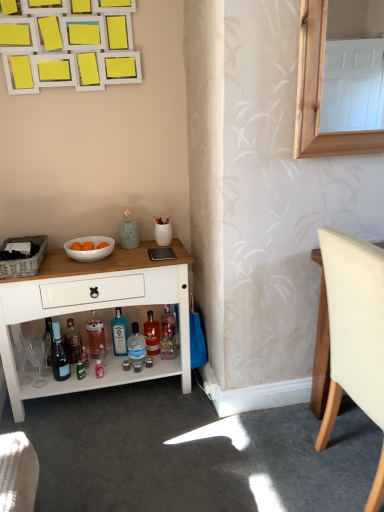
Question: In terms of size, does matte black picnic basket at left appear bigger or smaller than translucent glass bottle at lower center, which is the fifth bottle from left to right?

Choices:
 (A) small
 (B) big

Answer: (B)

Question: In the image, is matte black picnic basket at left on the left side or the right side of translucent glass bottle at lower center, the first bottle in the right-to-left sequence?

Choices:
 (A) left
 (B) right

Answer: (A)

Question: Which of these objects is positioned farthest from the matte black picnic basket at left?

Choices:
 (A) clear plastic bottle at lower center, which appears as the 2th bottle when viewed from the right
 (B) white wood cabinet at lower left
 (C) matte glass wine bottle at lower left
 (D) translucent plastic bottle at lower center, which is the 2th bottle in left-to-right order
 (E) white leather chair at right

Answer: (E)

Question: Which object is the farthest from the white glossy bowl at center?

Choices:
 (A) shiny dark glass bottle at lower left, placed as the 1th bottle when sorted from left to right
 (B) translucent glass bottle at lower center, the first bottle in the right-to-left sequence
 (C) clear plastic bottle at lower center, the 4th bottle in the left-to-right sequence
 (D) blue glass bottle at center, the 3th bottle when ordered from left to right
 (E) matte glass wine bottle at lower left

Answer: (C)